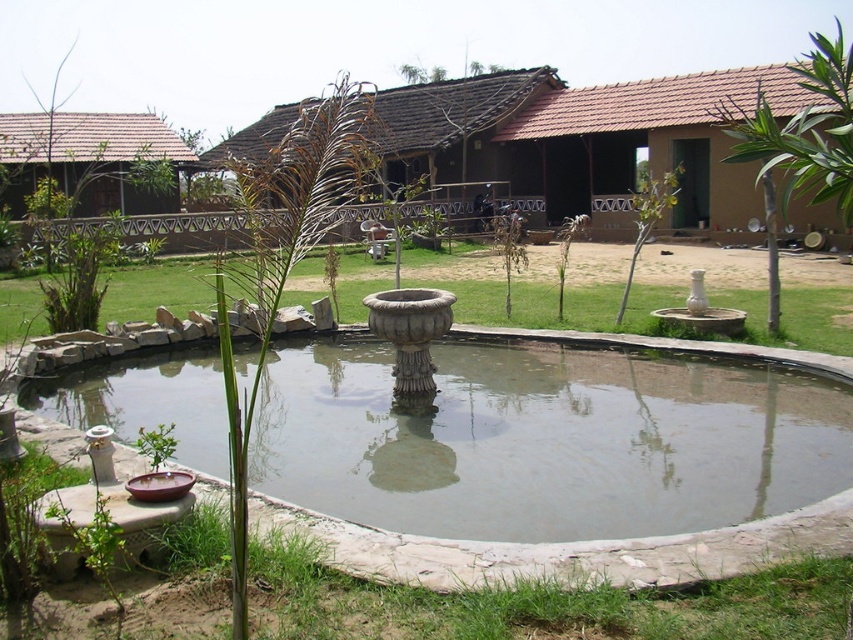
Question: Can you confirm if clear water at pond center is positioned to the left of brown stone fountain at center?

Choices:
 (A) yes
 (B) no

Answer: (B)

Question: Which object appears farthest from the camera in this image?

Choices:
 (A) brown clay hut at center
 (B) brown thatched hut at left
 (C) clear water at pond center
 (D) brown stone fountain at center

Answer: (B)

Question: Can you confirm if clear water at pond center is smaller than brown thatched hut at left?

Choices:
 (A) no
 (B) yes

Answer: (B)

Question: Which point appears farthest from the camera in this image?

Choices:
 (A) (567, 195)
 (B) (316, 392)

Answer: (A)

Question: Which object appears farthest from the camera in this image?

Choices:
 (A) brown clay hut at center
 (B) clear water at pond center

Answer: (A)

Question: Can you confirm if clear water at pond center is positioned to the left of brown stone fountain at center?

Choices:
 (A) yes
 (B) no

Answer: (B)